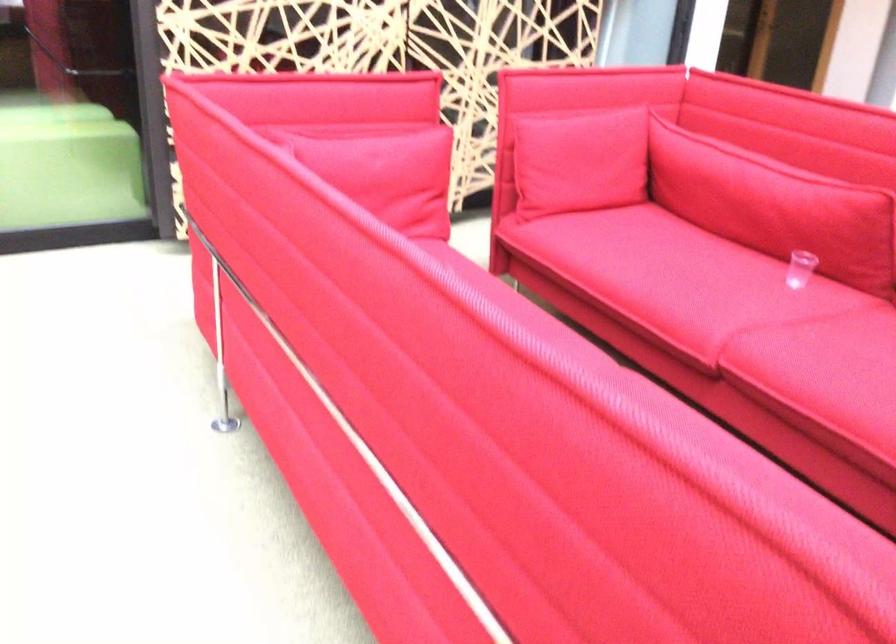
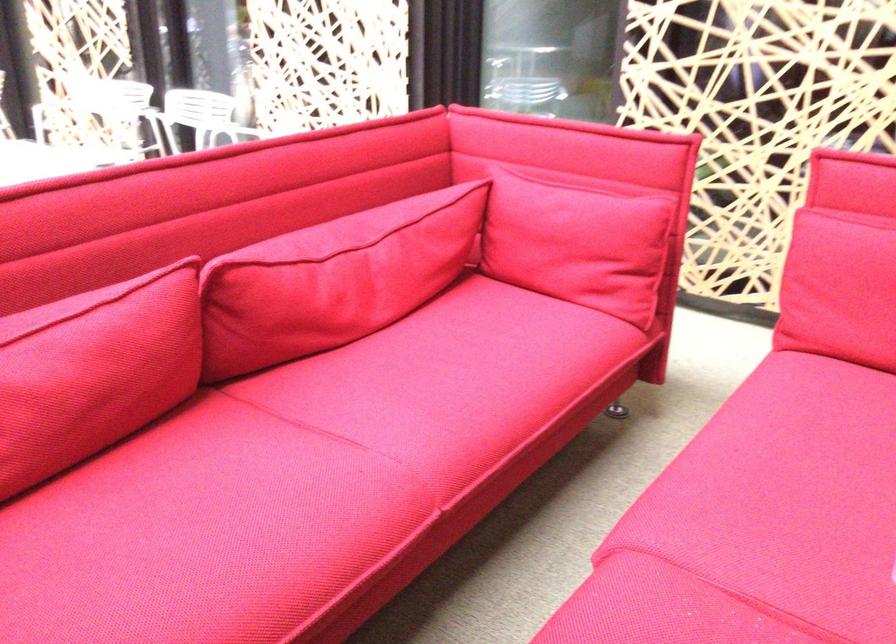
The point at (584, 167) is marked in the first image. Where is the corresponding point in the second image?

(840, 288)